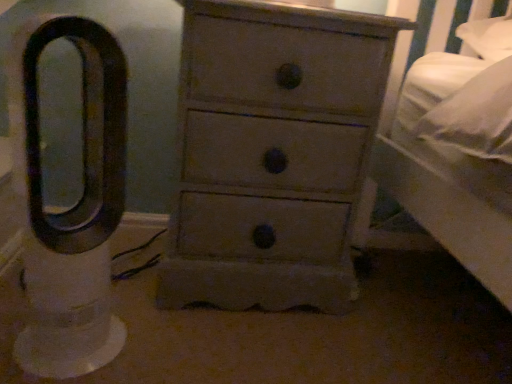
The height and width of the screenshot is (384, 512). What are the coordinates of `unoccupied region to the right of matte gray chest of drawers at center` in the screenshot? It's located at (410, 308).